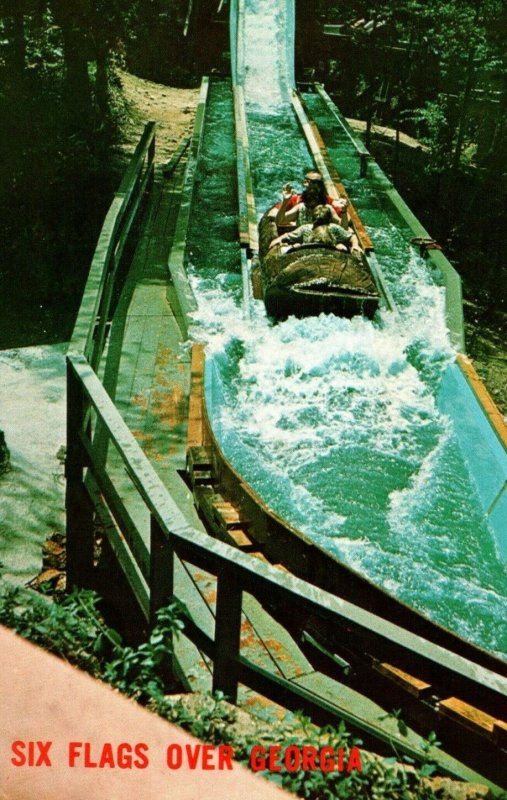
At what (x,y) coordinates should I click in order to perform the action: click on walk way. Please return your answer as a coordinate pair (x, y). The width and height of the screenshot is (507, 800). Looking at the image, I should click on (268, 650), (155, 378).